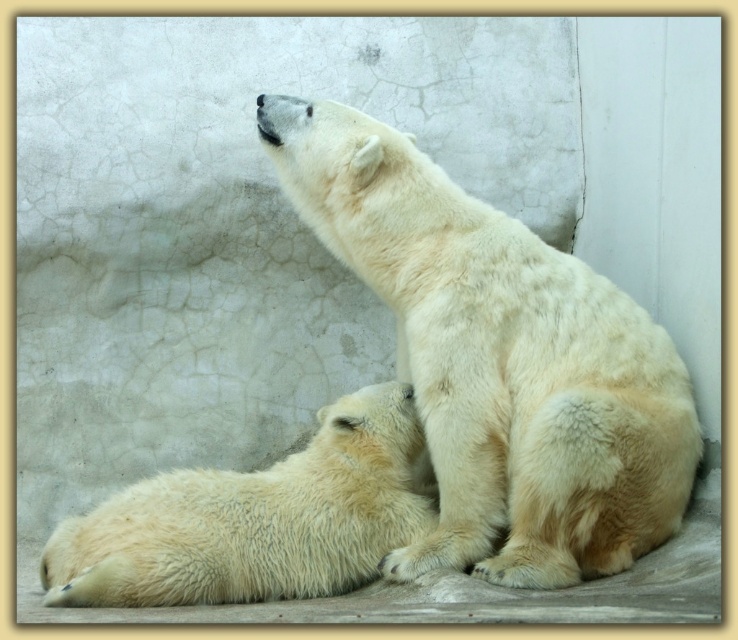
Is white fluffy polar bear at center thinner than white fluffy polar bear at lower left?

No, white fluffy polar bear at center is not thinner than white fluffy polar bear at lower left.

Is point (396, 227) positioned before point (337, 440)?

That is True.

You are a GUI agent. You are given a task and a screenshot of the screen. Output one action in this format:
    pyautogui.click(x=<x>, y=<y>)
    Task: Click on the white fluffy polar bear at center
    
    Given the screenshot: What is the action you would take?
    pyautogui.click(x=497, y=360)